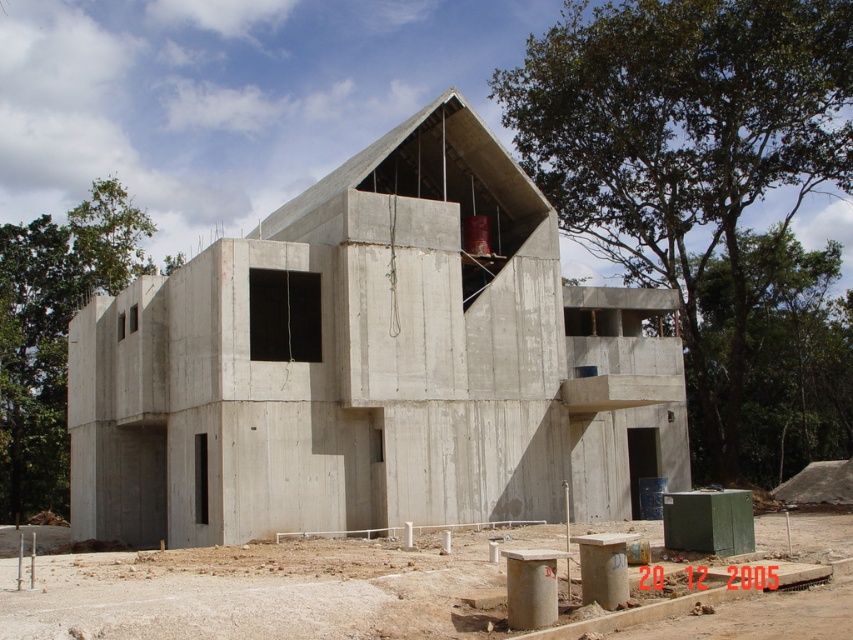
Is concrete building at center behind concrete at center?

Yes, concrete building at center is further from the viewer.

Is point (415, 422) closer to camera compared to point (80, 589)?

That is False.

Identify the location of concrete building at center. (372, 364).